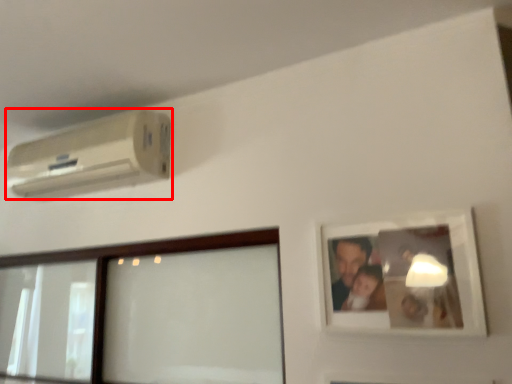
Question: From the image's perspective, where is air conditioning (annotated by the red box) located in relation to picture frame in the image?

Choices:
 (A) above
 (B) below

Answer: (A)